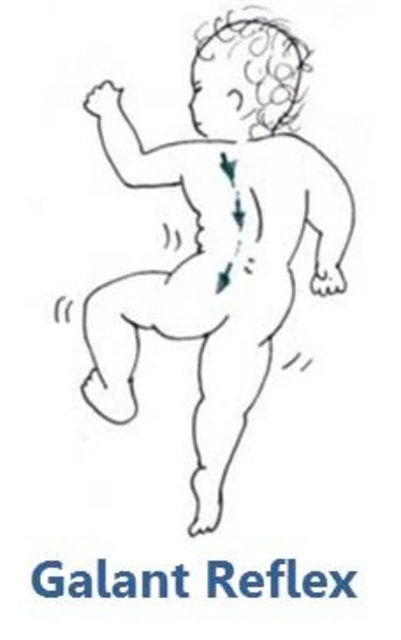
You are an artist analyzing a drawing. You need to determine the position of the white line drawing of baby at center relative to the edges of the image. Based on the coordinates provided, is the baby closer to the top or the bottom of the image?

The white line drawing of baby at center is located at point (x=220, y=240). Since the y coordinate is 0.551, which is closer to 1.0 than 0.0, the baby is closer to the bottom of the image.

You are an artist analyzing the composition of a drawing. The drawing has a point marked at coordinates point (220, 240). Based on the scene description, can you determine what this point corresponds to?

The point (220, 240) corresponds to the white line drawing of baby at center.